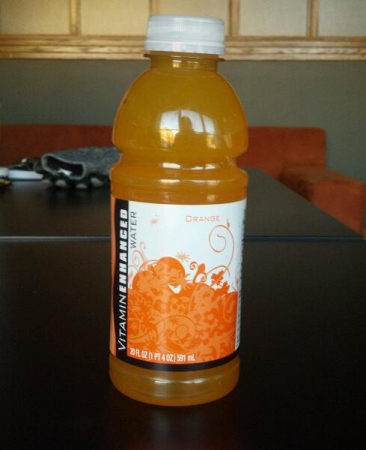
At what (x,y) coordinates should I click in order to perform the action: click on couch. Please return your answer as a coordinate pair (x, y). Image resolution: width=366 pixels, height=450 pixels. Looking at the image, I should click on (319, 177), (269, 142), (81, 147).